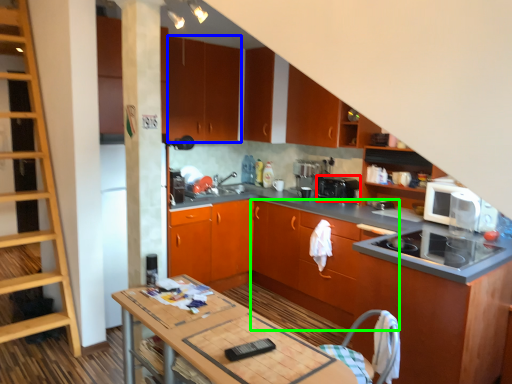
Question: Which object is the closest to the kitchen appliance (highlighted by a red box)? Choose among these: cabinetry (highlighted by a blue box) or cabinetry (highlighted by a green box).

Choices:
 (A) cabinetry
 (B) cabinetry

Answer: (B)